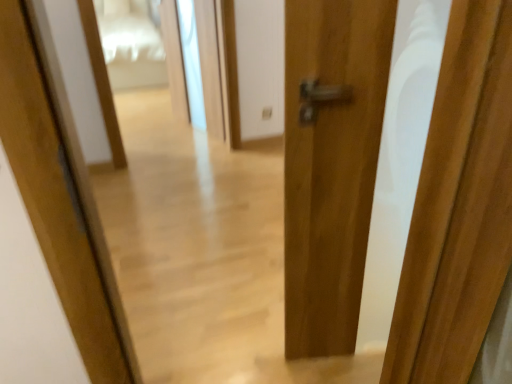
You are a GUI agent. You are given a task and a screenshot of the screen. Output one action in this format:
    pyautogui.click(x=<x>, y=<y>)
    Task: Click on the free space to the left of matte wood door at center
    Image resolution: width=512 pixels, height=384 pixels.
    Given the screenshot: What is the action you would take?
    pyautogui.click(x=258, y=345)